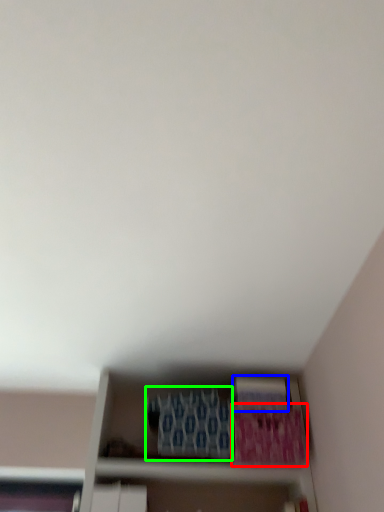
Question: Considering the real-world distances, which object is farthest from paperback book (highlighted by a red box)? paperback book (highlighted by a blue box) or paperback book (highlighted by a green box)?

Choices:
 (A) paperback book
 (B) paperback book

Answer: (B)